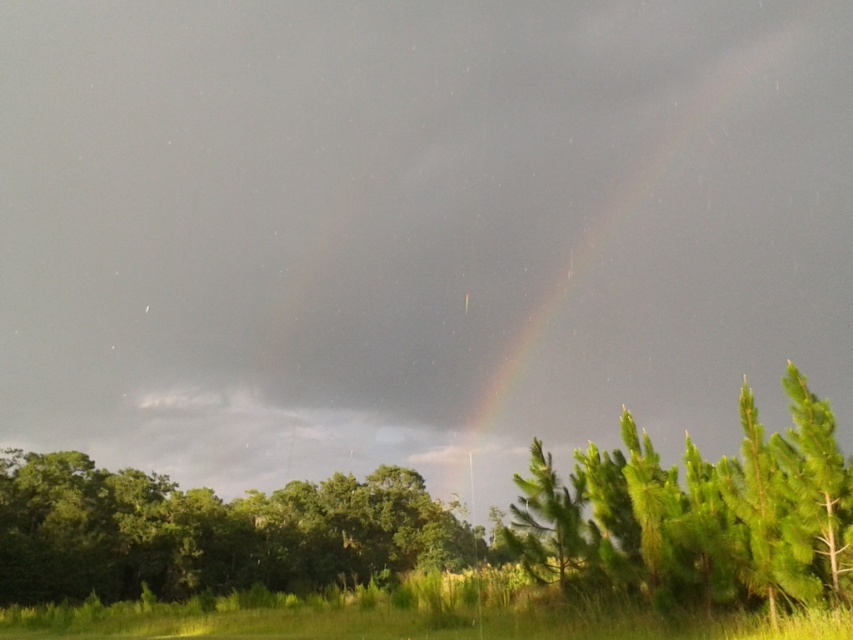
You are an artist trying to paint the scene. You want to ensure the green leafy tree at lower center and rainbow at upper right are positioned correctly. Based on the scene, which object should be placed farther away from the viewer?

The green leafy tree at lower center is behind the rainbow at upper right, so it should be placed farther away from the viewer than the rainbow.